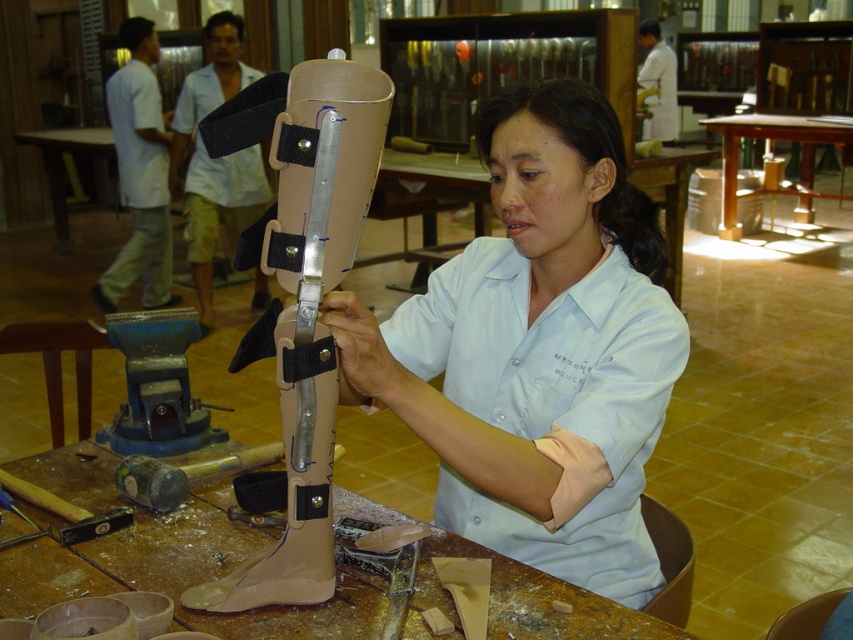
Is point (573, 282) more distant than point (729, 196)?

No, it is not.

Is point (376, 403) less distant than point (804, 166)?

Yes, point (376, 403) is in front of point (804, 166).

Where is `matte beige prosthetic leg at center`? matte beige prosthetic leg at center is located at coordinates (538, 349).

How far apart are tan matte prosthetic leg at center and wooden table at center?

17.74 feet

Looking at this image, who is more forward, (270, 586) or (741, 132)?

Point (270, 586)

The image size is (853, 640). Find the location of `tan matte prosthetic leg at center`. tan matte prosthetic leg at center is located at coordinates (299, 301).

In the scene shown: Can you confirm if matte beige prosthetic leg at center is thinner than tan matte prosthetic leg at center?

No.

Does matte beige prosthetic leg at center have a greater width compared to tan matte prosthetic leg at center?

Yes.

Which is behind, point (544, 483) or point (308, 422)?

The point (544, 483) is behind.

Where is `matte beige prosthetic leg at center`? matte beige prosthetic leg at center is located at coordinates (538, 349).